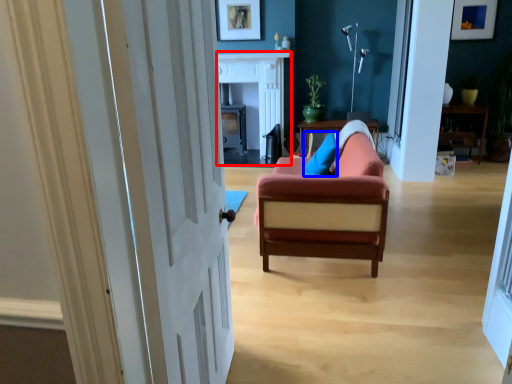
Question: Which object appears closest to the camera in this image, fireplace (highlighted by a red box) or pillow (highlighted by a blue box)?

Choices:
 (A) fireplace
 (B) pillow

Answer: (B)